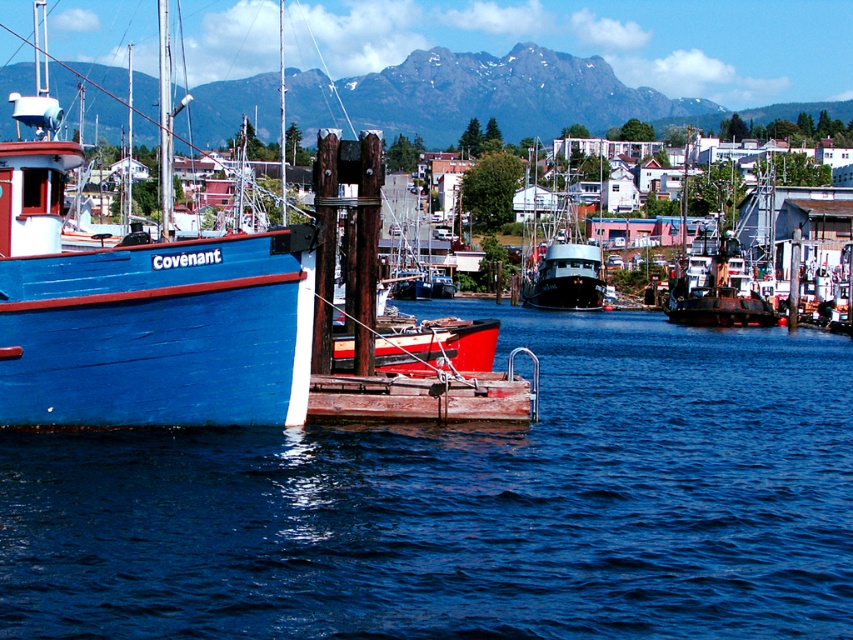
You are a sailor planning to navigate a new boat through the harbor. You see the blue water at left and the black matte boat at center. Which path should you choose to ensure your boat has enough space to maneuver safely?

You should choose the blue water at left because its width is larger than the black matte boat at center, providing more space for safe maneuvering.

Based on the photo, you are a sailor who needs to navigate between the blue water at left and the black matte boat at center. Which direction should you go to reach the water from the boat?

The blue water at left is positioned on the left side of the black matte boat at center. To reach the water from the boat, you should move towards the left.